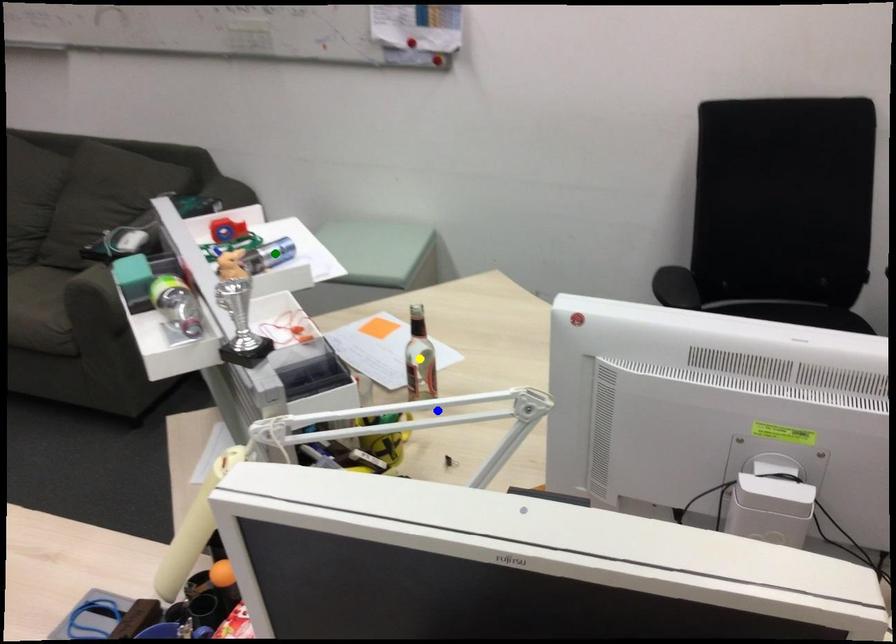
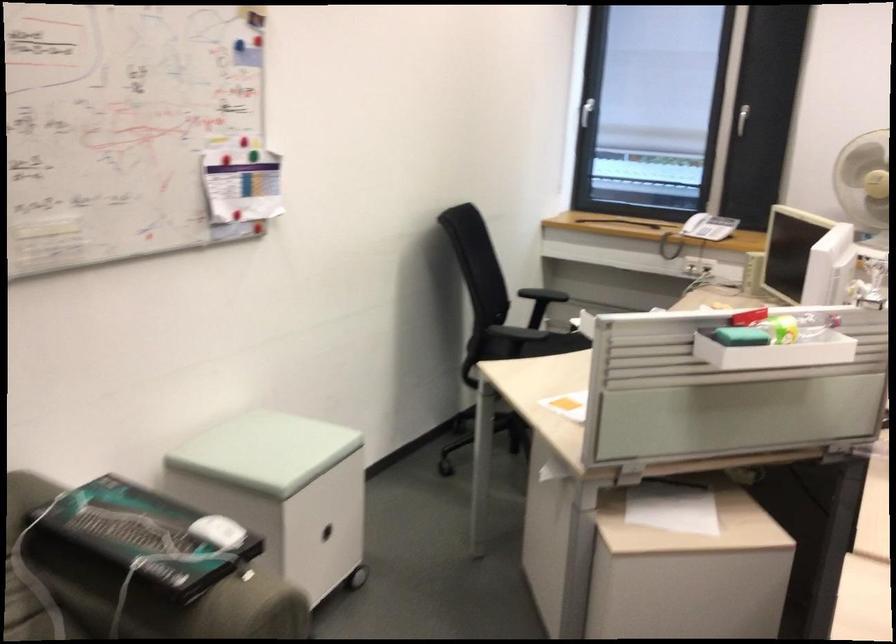
I am providing you with two images of the same scene from different viewpoints. Three points are marked in image1. Which point corresponds to a part or object that is occluded in image2?In image1, three points are marked. Which of them correspond to a part or object that is occluded in image2?Among the three points shown in image1, which one corresponds to a part or object that is no longer visible due to occlusion in image2?

Invisible in image2: yellow point, blue point, green point.